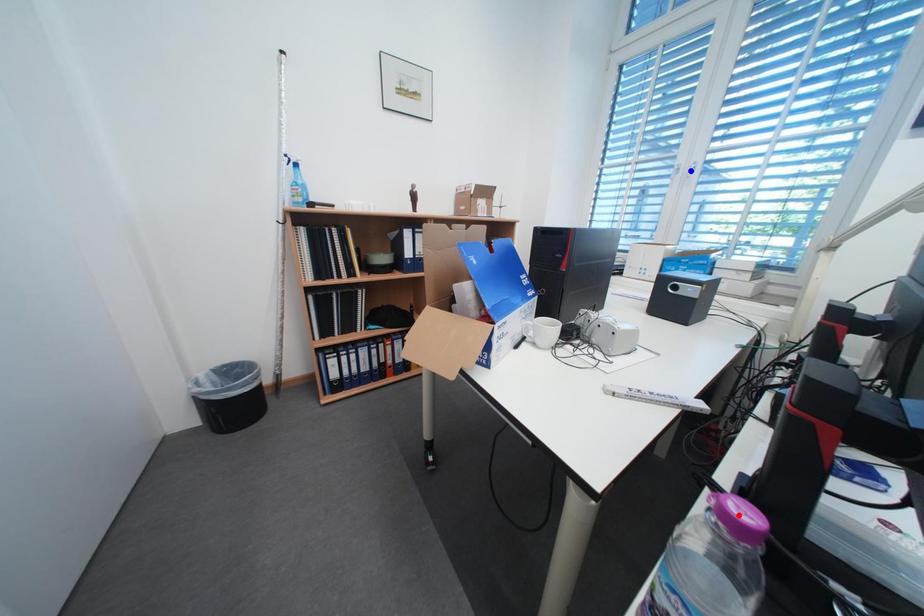
Question: Which of the two points in the image is closer to the camera?

Choices:
 (A) Blue point is closer.
 (B) Red point is closer.

Answer: (B)